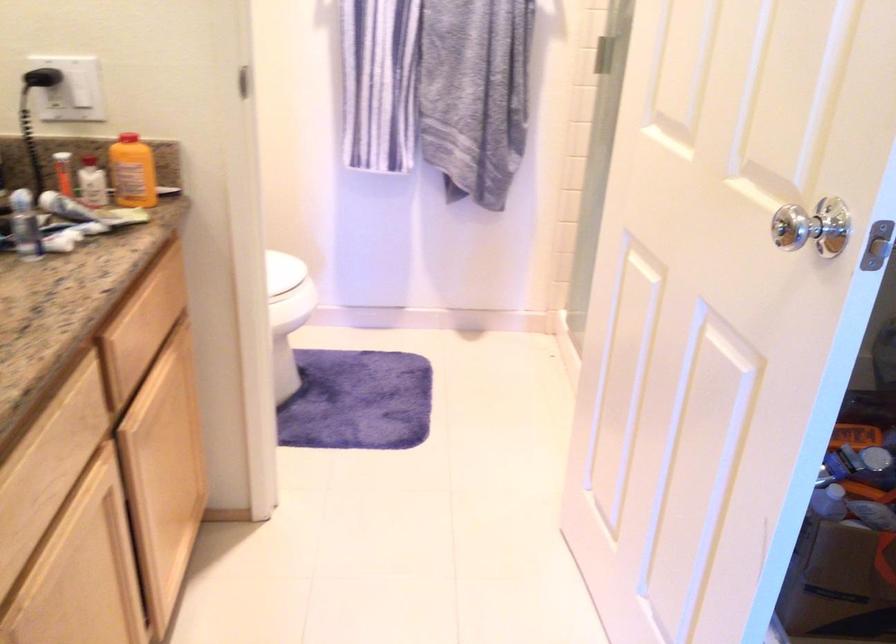
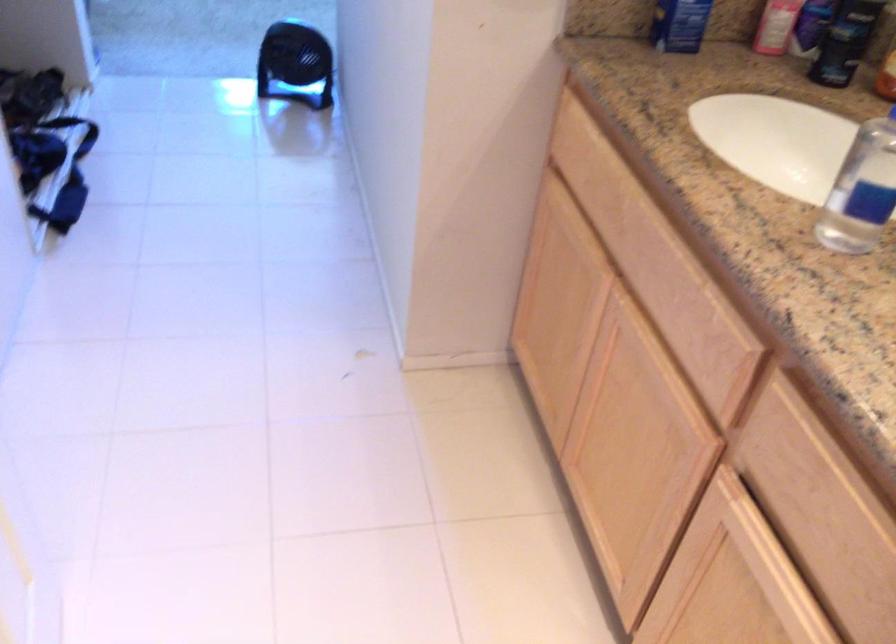
Where in the second image is the point corresponding to point (156, 393) from the first image?

(754, 536)